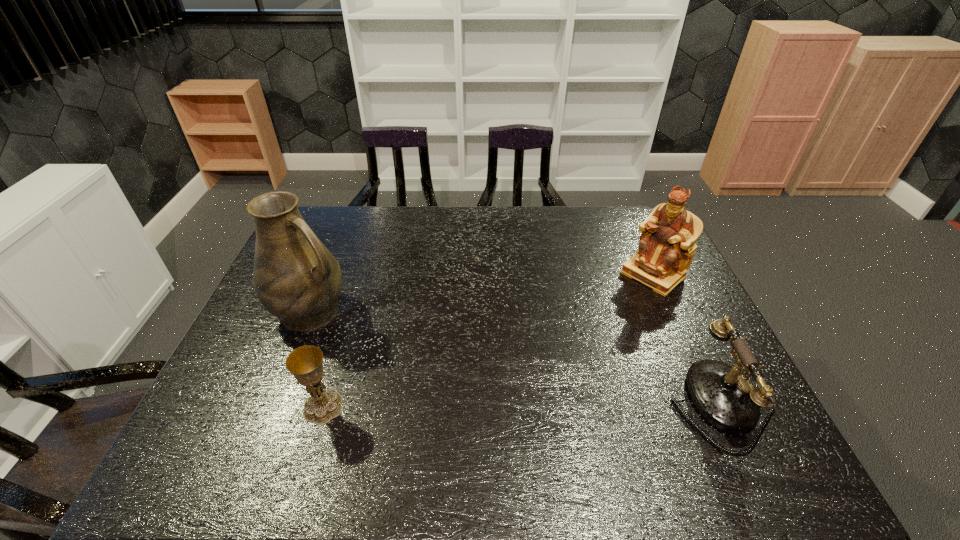
You are a GUI agent. You are given a task and a screenshot of the screen. Output one action in this format:
    pyautogui.click(x=<x>, y=<y>)
    Task: Click on the object that is the third nearest to the figurine
    
    Given the screenshot: What is the action you would take?
    pyautogui.click(x=305, y=363)

You are a GUI agent. You are given a task and a screenshot of the screen. Output one action in this format:
    pyautogui.click(x=<x>, y=<y>)
    Task: Click on the object identified as the second closest to the tallest object
    The image size is (960, 540).
    Given the screenshot: What is the action you would take?
    click(666, 248)

At what (x,y) coordinates should I click in order to perform the action: click on free space in the image that satisfies the following two spatial constraints: 1. on the back side of the third shortest object; 2. on the right side of the chalice. Please return your answer as a coordinate pair (x, y). The height and width of the screenshot is (540, 960). Looking at the image, I should click on (364, 275).

Where is `vacant space that satisfies the following two spatial constraints: 1. on the front side of the telephone; 2. on the dial of the third shortest object`? This screenshot has height=540, width=960. vacant space that satisfies the following two spatial constraints: 1. on the front side of the telephone; 2. on the dial of the third shortest object is located at coordinates (711, 405).

Identify the location of free space that satisfies the following two spatial constraints: 1. on the front side of the pitcher; 2. on the dial of the telephone. (274, 405).

Where is `free point that satisfies the following two spatial constraints: 1. on the back side of the chalice; 2. on the dial of the telephone`? Image resolution: width=960 pixels, height=540 pixels. free point that satisfies the following two spatial constraints: 1. on the back side of the chalice; 2. on the dial of the telephone is located at coordinates (324, 405).